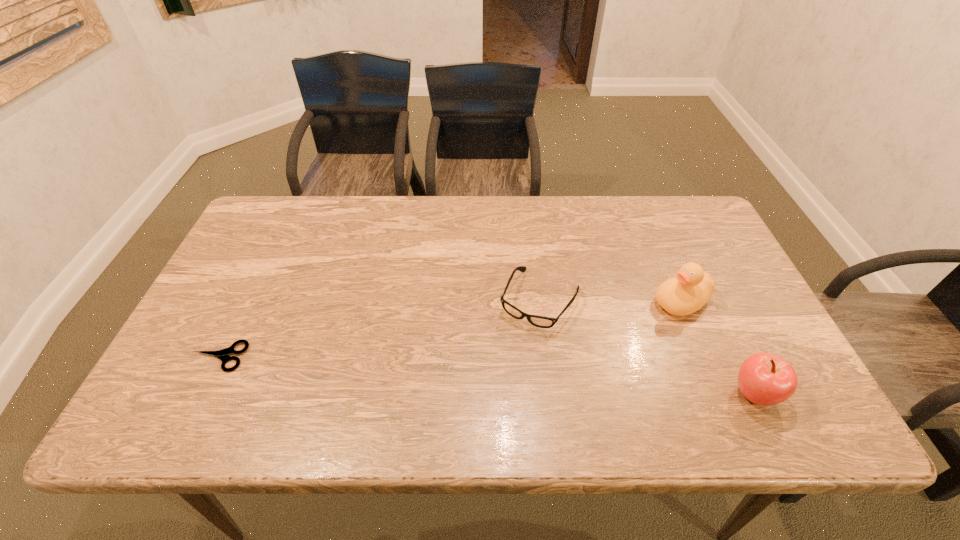
Locate an element on the screen. Image resolution: width=960 pixels, height=540 pixels. vacant space on the desktop that is between the third farthest object and the nearest object and is positioned on the face of the duck is located at coordinates (531, 379).

Identify the location of free space on the desktop that is between the third farthest object and the apple and is positioned on the front-facing side of the spectacles. (497, 376).